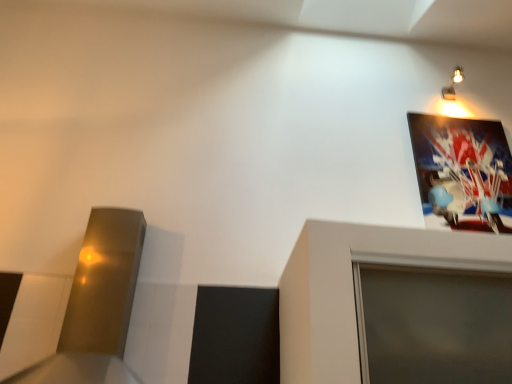
You are a GUI agent. You are given a task and a screenshot of the screen. Output one action in this format:
    pyautogui.click(x=<x>, y=<y>)
    Task: Click on the metallic glossy picture frame at upper right
    The width and height of the screenshot is (512, 384).
    Given the screenshot: What is the action you would take?
    (x=463, y=169)

What do you see at coordinates (463, 169) in the screenshot?
I see `metallic glossy picture frame at upper right` at bounding box center [463, 169].

I want to click on metallic wall sconce at upper right, so click(x=453, y=84).

Describe the element at coordinates (453, 84) in the screenshot. I see `metallic wall sconce at upper right` at that location.

I want to click on metallic glossy picture frame at upper right, so click(463, 169).

Based on their positions, is metallic glossy picture frame at upper right located to the left or right of metallic wall sconce at upper right?

Clearly, metallic glossy picture frame at upper right is on the left of metallic wall sconce at upper right in the image.

Relative to metallic wall sconce at upper right, is metallic glossy picture frame at upper right in front or behind?

Visually, metallic glossy picture frame at upper right is located in front of metallic wall sconce at upper right.

Considering the positions of points (452, 210) and (443, 91), is point (452, 210) farther from camera compared to point (443, 91)?

No.

From the image's perspective, is metallic glossy picture frame at upper right under metallic wall sconce at upper right?

Indeed, from the image's perspective, metallic glossy picture frame at upper right is shown beneath metallic wall sconce at upper right.

Consider the image. From a real-world perspective, which is physically above, metallic glossy picture frame at upper right or metallic wall sconce at upper right?

metallic wall sconce at upper right.

Which of these two, metallic glossy picture frame at upper right or metallic wall sconce at upper right, is thinner?

With smaller width is metallic glossy picture frame at upper right.

From the picture: Who is taller, metallic glossy picture frame at upper right or metallic wall sconce at upper right?

metallic glossy picture frame at upper right is taller.

In the scene shown: Is metallic glossy picture frame at upper right bigger or smaller than metallic wall sconce at upper right?

Clearly, metallic glossy picture frame at upper right is larger in size than metallic wall sconce at upper right.

Is metallic glossy picture frame at upper right surrounding metallic wall sconce at upper right?

Definitely not — metallic wall sconce at upper right is not inside metallic glossy picture frame at upper right.

Are metallic glossy picture frame at upper right and metallic wall sconce at upper right located far from each other?

Actually, metallic glossy picture frame at upper right and metallic wall sconce at upper right are a little close together.

Consider the image. Is metallic glossy picture frame at upper right positioned with its back to metallic wall sconce at upper right?

No, metallic glossy picture frame at upper right is not facing the opposite direction of metallic wall sconce at upper right.

The height and width of the screenshot is (384, 512). I want to click on picture frame located in front of the metallic wall sconce at upper right, so click(463, 169).

Which object is positioned more to the left, metallic wall sconce at upper right or metallic glossy picture frame at upper right?

From the viewer's perspective, metallic glossy picture frame at upper right appears more on the left side.

Considering their positions, is metallic wall sconce at upper right located in front of or behind metallic glossy picture frame at upper right?

Clearly, metallic wall sconce at upper right is behind metallic glossy picture frame at upper right.

Which is closer to the camera, (453, 98) or (426, 140)?

Positioned in front is point (426, 140).

From the image's perspective, which is above, metallic wall sconce at upper right or metallic glossy picture frame at upper right?

metallic wall sconce at upper right, from the image's perspective.

From a real-world perspective, which object stands above the other?

In real-world perspective, metallic wall sconce at upper right is above.

In terms of width, does metallic wall sconce at upper right look wider or thinner when compared to metallic glossy picture frame at upper right?

Clearly, metallic wall sconce at upper right has more width compared to metallic glossy picture frame at upper right.

Is metallic wall sconce at upper right taller than metallic glossy picture frame at upper right?

Incorrect, the height of metallic wall sconce at upper right is not larger of that of metallic glossy picture frame at upper right.

In the scene shown: Which of these two, metallic wall sconce at upper right or metallic glossy picture frame at upper right, is bigger?

Bigger between the two is metallic glossy picture frame at upper right.

Do you think metallic wall sconce at upper right is within metallic glossy picture frame at upper right, or outside of it?

metallic wall sconce at upper right is outside metallic glossy picture frame at upper right.

Is metallic wall sconce at upper right positioned far away from metallic glossy picture frame at upper right?

No, metallic wall sconce at upper right is in close proximity to metallic glossy picture frame at upper right.

From the picture: Is metallic wall sconce at upper right positioned with its back to metallic glossy picture frame at upper right?

metallic wall sconce at upper right does not have its back to metallic glossy picture frame at upper right.

Can you tell me how much metallic wall sconce at upper right and metallic glossy picture frame at upper right differ in facing direction?

The facing directions of metallic wall sconce at upper right and metallic glossy picture frame at upper right are 0.00142 degrees apart.

Could you measure the distance between metallic wall sconce at upper right and metallic glossy picture frame at upper right?

They are 20.67 inches apart.

This screenshot has height=384, width=512. I want to click on light fixture behind the metallic glossy picture frame at upper right, so pos(453,84).

Identify the location of picture frame on the left of metallic wall sconce at upper right. The height and width of the screenshot is (384, 512). (463, 169).

Find the location of `picture frame below the metallic wall sconce at upper right (from a real-world perspective)`. picture frame below the metallic wall sconce at upper right (from a real-world perspective) is located at coordinates (463, 169).